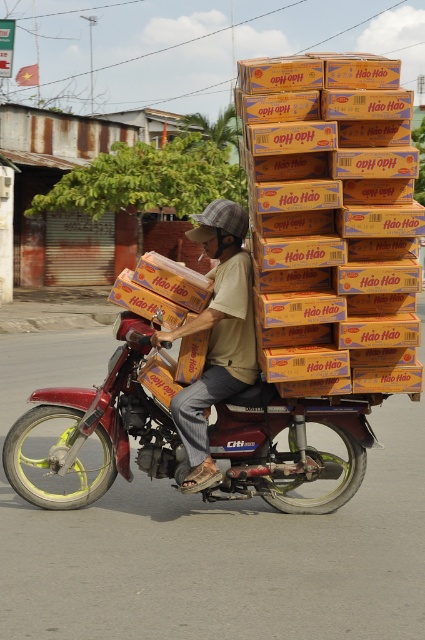
You are a delivery person who needs to deliver a package to the customer. You are currently standing at point (99, 428). Looking around, you see a metallic red motorcycle at center. Where is the metallic red motorcycle located relative to your current position?

The metallic red motorcycle at center is located at your current position at point (99, 428).

Based on the photo, you are a delivery person who needs to know if your metallic red motorcycle at center can carry a heavy package. Considering the size of the brown cotton shirt at center, can you estimate if the motorcycle has enough space?

The metallic red motorcycle at center is larger than the brown cotton shirt at center, so it likely has sufficient space to carry a heavy package.

You are a delivery person who needs to check if your metallic red motorcycle at center can fit through a narrow alley that is only 1.2 meters wide. The brown cotton shirt at center is part of your uniform. Based on the scene, can you determine if the motorcycle will fit?

The metallic red motorcycle at center is positioned on the left side of brown cotton shirt at center, but the width of the motorcycle itself is not provided in the description. Therefore, it is impossible to determine if it can fit through the 1.2 meter wide alley without additional information.